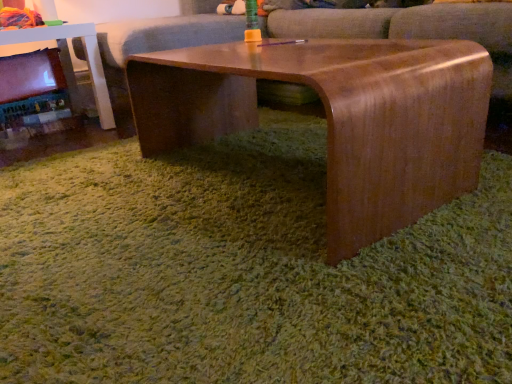
Question: Should I look upward or downward to see wooden couch at center?

Choices:
 (A) down
 (B) up

Answer: (B)

Question: Is satin wood swivel chair at center positioned in front of matte black fireplace at left?

Choices:
 (A) yes
 (B) no

Answer: (A)

Question: Does satin wood swivel chair at center touch matte black fireplace at left?

Choices:
 (A) yes
 (B) no

Answer: (B)

Question: Is the position of satin wood swivel chair at center more distant than that of matte black fireplace at left?

Choices:
 (A) no
 (B) yes

Answer: (A)

Question: From a real-world perspective, is satin wood swivel chair at center beneath matte black fireplace at left?

Choices:
 (A) yes
 (B) no

Answer: (B)

Question: Is satin wood swivel chair at center outside matte black fireplace at left?

Choices:
 (A) yes
 (B) no

Answer: (A)

Question: Does satin wood swivel chair at center appear on the right side of matte black fireplace at left?

Choices:
 (A) yes
 (B) no

Answer: (A)

Question: Is wooden table at left turned away from matte black fireplace at left?

Choices:
 (A) no
 (B) yes

Answer: (B)

Question: Is wooden table at left not close to matte black fireplace at left?

Choices:
 (A) no
 (B) yes

Answer: (A)

Question: Is wooden table at left oriented towards matte black fireplace at left?

Choices:
 (A) yes
 (B) no

Answer: (A)

Question: Can you confirm if wooden table at left is positioned to the left of matte black fireplace at left?

Choices:
 (A) yes
 (B) no

Answer: (B)

Question: Considering the relative positions of wooden table at left and matte black fireplace at left in the image provided, is wooden table at left in front of matte black fireplace at left?

Choices:
 (A) no
 (B) yes

Answer: (B)

Question: Is wooden table at left at the right side of matte black fireplace at left?

Choices:
 (A) yes
 (B) no

Answer: (A)

Question: From the image's perspective, is matte black fireplace at left over satin wood coffee table at center?

Choices:
 (A) no
 (B) yes

Answer: (B)